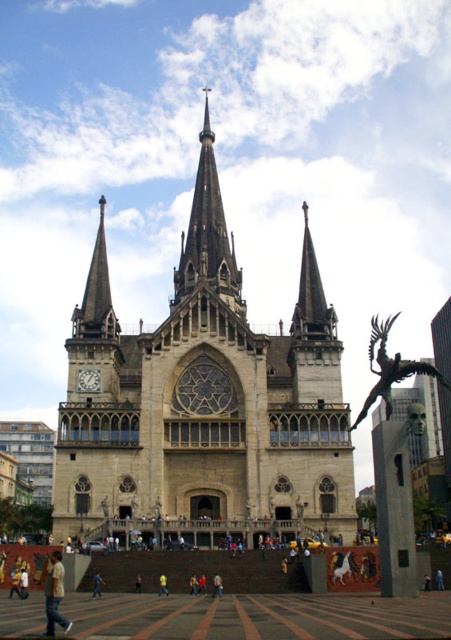
Question: Which is farther from the dark gray stone spire at center?

Choices:
 (A) light brown leather jacket at center
 (B) light blue jeans at lower center
 (C) stone church at center

Answer: (B)

Question: Among these points, which one is farthest from the camera?

Choices:
 (A) (311, 241)
 (B) (239, 472)

Answer: (A)

Question: Considering the real-world distances, which object is farthest from the matte gray clock at center?

Choices:
 (A) light blue jeans at lower center
 (B) dark gray stone spire at center
 (C) smooth stone spire at upper center
 (D) light brown leather jacket at center

Answer: (B)

Question: Does brick pavement at center appear under dark gray stone spire at center?

Choices:
 (A) no
 (B) yes

Answer: (B)

Question: Is the position of bronze/statue at right less distant than that of yellow fabric person at center?

Choices:
 (A) yes
 (B) no

Answer: (A)

Question: Is brick pavement at center positioned in front of light blue jeans at lower center?

Choices:
 (A) yes
 (B) no

Answer: (A)